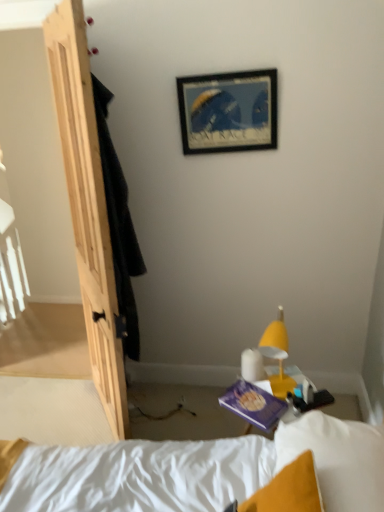
Question: From the image's perspective, is natural wood door at left beneath yellow matte lamp at lower right?

Choices:
 (A) yes
 (B) no

Answer: (B)

Question: From a real-world perspective, is natural wood door at left beneath yellow matte lamp at lower right?

Choices:
 (A) no
 (B) yes

Answer: (A)

Question: Is yellow matte lamp at lower right at the back of natural wood door at left?

Choices:
 (A) yes
 (B) no

Answer: (B)

Question: From the image's perspective, is natural wood door at left above yellow matte lamp at lower right?

Choices:
 (A) yes
 (B) no

Answer: (A)

Question: Are natural wood door at left and yellow matte lamp at lower right making contact?

Choices:
 (A) yes
 (B) no

Answer: (B)

Question: Is purple matte paperback book at lower center in front of or behind yellow matte lamp at lower right in the image?

Choices:
 (A) front
 (B) behind

Answer: (B)

Question: Is purple matte paperback book at lower center inside the boundaries of yellow matte lamp at lower right, or outside?

Choices:
 (A) inside
 (B) outside

Answer: (B)

Question: Looking at their shapes, would you say purple matte paperback book at lower center is wider or thinner than yellow matte lamp at lower right?

Choices:
 (A) thin
 (B) wide

Answer: (B)

Question: Does point (266, 419) appear closer or farther from the camera than point (281, 359)?

Choices:
 (A) farther
 (B) closer

Answer: (B)

Question: Considering the positions of wooden picture frame at upper center and purple matte paperback book at lower center in the image, is wooden picture frame at upper center bigger or smaller than purple matte paperback book at lower center?

Choices:
 (A) big
 (B) small

Answer: (A)

Question: Considering the positions of wooden picture frame at upper center and purple matte paperback book at lower center in the image, is wooden picture frame at upper center taller or shorter than purple matte paperback book at lower center?

Choices:
 (A) tall
 (B) short

Answer: (A)

Question: Considering the positions of wooden picture frame at upper center and purple matte paperback book at lower center in the image, is wooden picture frame at upper center wider or thinner than purple matte paperback book at lower center?

Choices:
 (A) thin
 (B) wide

Answer: (A)

Question: From a real-world perspective, is wooden picture frame at upper center physically located above or below purple matte paperback book at lower center?

Choices:
 (A) below
 (B) above

Answer: (B)

Question: From a real-world perspective, is yellow matte lamp at lower right above or below wooden picture frame at upper center?

Choices:
 (A) below
 (B) above

Answer: (A)

Question: Is yellow matte lamp at lower right bigger or smaller than wooden picture frame at upper center?

Choices:
 (A) big
 (B) small

Answer: (A)